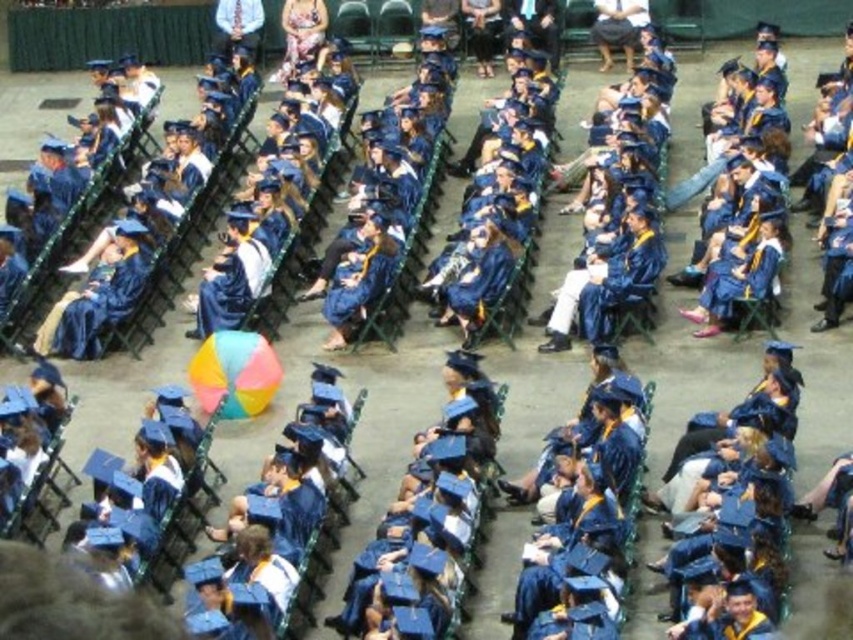
Is matte blue gown at left further to the viewer compared to matte blue gown at center?

Yes.

Is point (74, 317) farther from viewer compared to point (370, 275)?

No, it is in front of (370, 275).

Who is more distant from viewer, (77,340) or (381,250)?

Positioned behind is point (381,250).

This screenshot has width=853, height=640. Find the location of `matte blue gown at left`. matte blue gown at left is located at coordinates (102, 307).